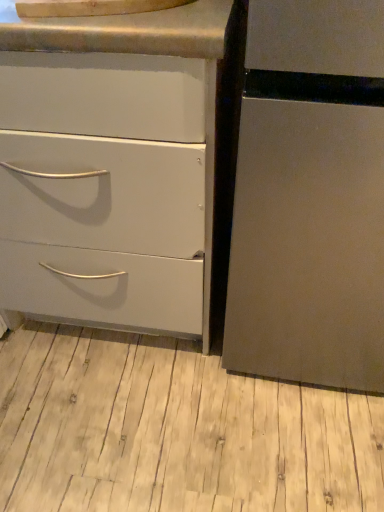
Question: Is matte white drawer at left inside or outside of light wood floor at lower center?

Choices:
 (A) inside
 (B) outside

Answer: (B)

Question: In the image, is matte white drawer at left on the left side or the right side of light wood floor at lower center?

Choices:
 (A) right
 (B) left

Answer: (B)

Question: Which of these objects is positioned farthest from the light wood floor at lower center?

Choices:
 (A) brushed metal counter top at upper center
 (B) matte white drawer at left

Answer: (A)

Question: Which is farther from the matte white drawer at left?

Choices:
 (A) brushed metal counter top at upper center
 (B) light wood floor at lower center

Answer: (B)